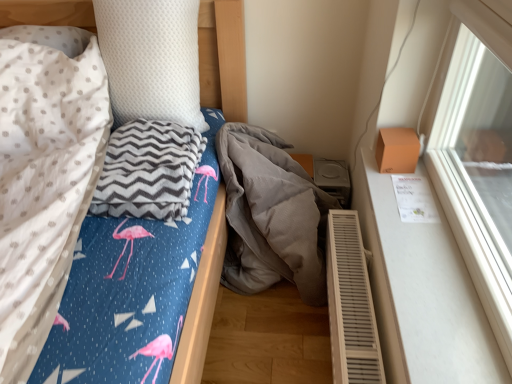
Where is `blank space situated above white plastic air conditioner at lower right (from a real-world perspective)`? The image size is (512, 384). blank space situated above white plastic air conditioner at lower right (from a real-world perspective) is located at coordinates (359, 281).